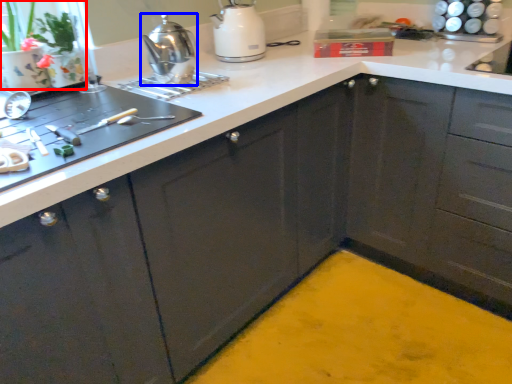
Question: Which point is further to the camera, plant (highlighted by a red box) or kitchen appliance (highlighted by a blue box)?

Choices:
 (A) plant
 (B) kitchen appliance

Answer: (B)